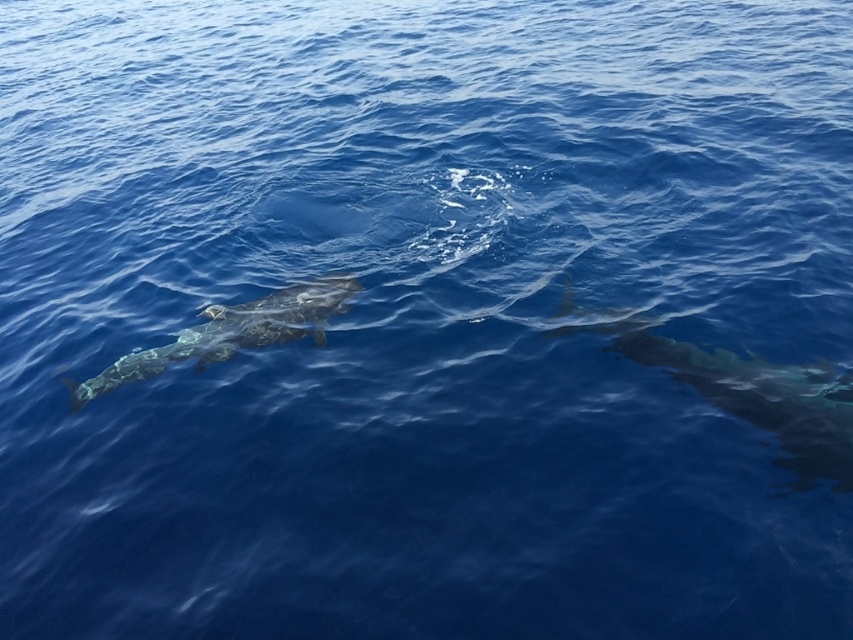
You are a marine biologist studying whale migration patterns. You observe the shiny dark gray whale at right in the ocean. Based on its position in the image, what are the coordinates of the whale?

The coordinates of the shiny dark gray whale at right are at point (753, 396).

You are a marine biologist observing the ocean scene. You notice two whales, the shiny dark gray whale at right and the smooth gray whale at left. Which whale appears bigger in the image?

The shiny dark gray whale at right appears bigger in the image compared to the smooth gray whale at left as it has a larger size.